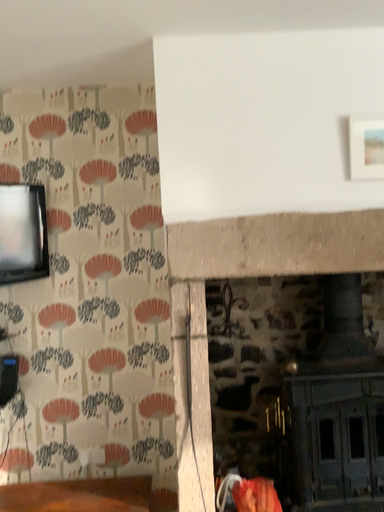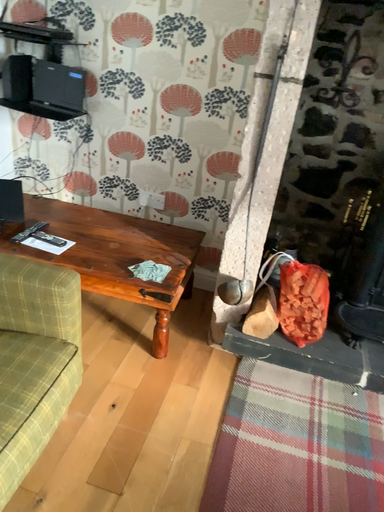
Question: How did the camera likely rotate when shooting the video?

Choices:
 (A) rotated downward
 (B) rotated upward

Answer: (A)